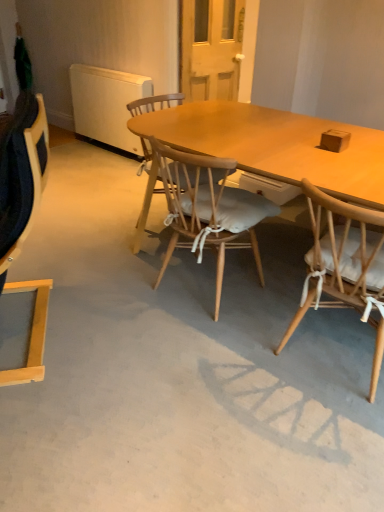
At what (x,y) coordinates should I click in order to perform the action: click on vacant space in wooden chair with cushion at center, arranged as the second chair when viewed from the left (from a real-world perspective). Please return your answer as a coordinate pair (x, y). Looking at the image, I should click on (206, 286).